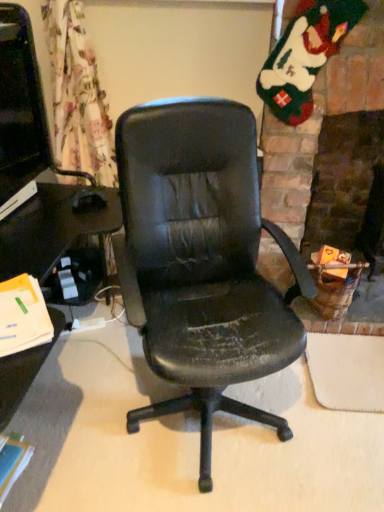
What do you see at coordinates (305, 55) in the screenshot?
I see `fuzzy felt stocking at upper right` at bounding box center [305, 55].

Where is `fuzzy felt stocking at upper right`? fuzzy felt stocking at upper right is located at coordinates (305, 55).

What is the approximate width of matte black monitor at left?

matte black monitor at left is 5.07 inches in width.

You are a GUI agent. You are given a task and a screenshot of the screen. Output one action in this format:
    pyautogui.click(x=<x>, y=<y>)
    Task: Click on the matte black monitor at left
    Image resolution: width=384 pixels, height=512 pixels.
    Given the screenshot: What is the action you would take?
    pyautogui.click(x=20, y=112)

The width and height of the screenshot is (384, 512). Describe the element at coordinates (20, 112) in the screenshot. I see `matte black monitor at left` at that location.

What are the coordinates of `fuzzy felt stocking at upper right` in the screenshot? It's located at (305, 55).

Visually, is matte black monitor at left positioned to the left or to the right of fuzzy felt stocking at upper right?

In the image, matte black monitor at left appears on the left side of fuzzy felt stocking at upper right.

Considering the positions of objects matte black monitor at left and fuzzy felt stocking at upper right in the image provided, who is behind, matte black monitor at left or fuzzy felt stocking at upper right?

fuzzy felt stocking at upper right.

Which is behind, point (9, 103) or point (266, 97)?

The point (266, 97) is behind.

From the image's perspective, which one is positioned higher, matte black monitor at left or fuzzy felt stocking at upper right?

From the image's view, fuzzy felt stocking at upper right is above.

In the scene shown: From a real-world perspective, relative to fuzzy felt stocking at upper right, is matte black monitor at left vertically above or below?

In terms of real-world spatial position, matte black monitor at left is below fuzzy felt stocking at upper right.

Considering the relative sizes of matte black monitor at left and fuzzy felt stocking at upper right in the image provided, is matte black monitor at left thinner than fuzzy felt stocking at upper right?

In fact, matte black monitor at left might be wider than fuzzy felt stocking at upper right.

Is matte black monitor at left taller than fuzzy felt stocking at upper right?

No.

Considering the sizes of matte black monitor at left and fuzzy felt stocking at upper right in the image, is matte black monitor at left bigger or smaller than fuzzy felt stocking at upper right?

Considering their sizes, matte black monitor at left takes up more space than fuzzy felt stocking at upper right.

Is fuzzy felt stocking at upper right completely or partially inside matte black monitor at left?

That's incorrect, fuzzy felt stocking at upper right is not inside matte black monitor at left.

Are matte black monitor at left and fuzzy felt stocking at upper right located far from each other?

matte black monitor at left is positioned a significant distance from fuzzy felt stocking at upper right.

Is fuzzy felt stocking at upper right at the back of matte black monitor at left?

No, matte black monitor at left is not facing the opposite direction of fuzzy felt stocking at upper right.

Where is `computer monitor in front of the fuzzy felt stocking at upper right`? computer monitor in front of the fuzzy felt stocking at upper right is located at coordinates (20, 112).

Is fuzzy felt stocking at upper right to the left of matte black monitor at left from the viewer's perspective?

No.

Which object is further away from the camera taking this photo, fuzzy felt stocking at upper right or matte black monitor at left?

fuzzy felt stocking at upper right is more distant.

Is point (267, 78) less distant than point (2, 165)?

Yes, it is.

From the image's perspective, is fuzzy felt stocking at upper right positioned above or below matte black monitor at left?

Based on their image positions, fuzzy felt stocking at upper right is located above matte black monitor at left.

From a real-world perspective, which object stands above the other?

fuzzy felt stocking at upper right, from a real-world perspective.

Is fuzzy felt stocking at upper right wider or thinner than matte black monitor at left?

In the image, fuzzy felt stocking at upper right appears to be more narrow than matte black monitor at left.

Which of these two, fuzzy felt stocking at upper right or matte black monitor at left, stands shorter?

With less height is matte black monitor at left.

Between fuzzy felt stocking at upper right and matte black monitor at left, which one has smaller size?

With smaller size is fuzzy felt stocking at upper right.

Is fuzzy felt stocking at upper right completely or partially outside of matte black monitor at left?

Yes.

Is fuzzy felt stocking at upper right with matte black monitor at left?

No, fuzzy felt stocking at upper right is not next to matte black monitor at left.

Is fuzzy felt stocking at upper right positioned with its back to matte black monitor at left?

fuzzy felt stocking at upper right is not turned away from matte black monitor at left.

What's the angular difference between fuzzy felt stocking at upper right and matte black monitor at left's facing directions?

They differ by 65.7 degrees in their facing directions.

Identify the location of computer monitor below the fuzzy felt stocking at upper right (from a real-world perspective). This screenshot has width=384, height=512. (20, 112).

Identify the location of santa claus behind the matte black monitor at left. The image size is (384, 512). (305, 55).

Find the location of a particular element. The image size is (384, 512). santa claus to the right of matte black monitor at left is located at coordinates 305,55.